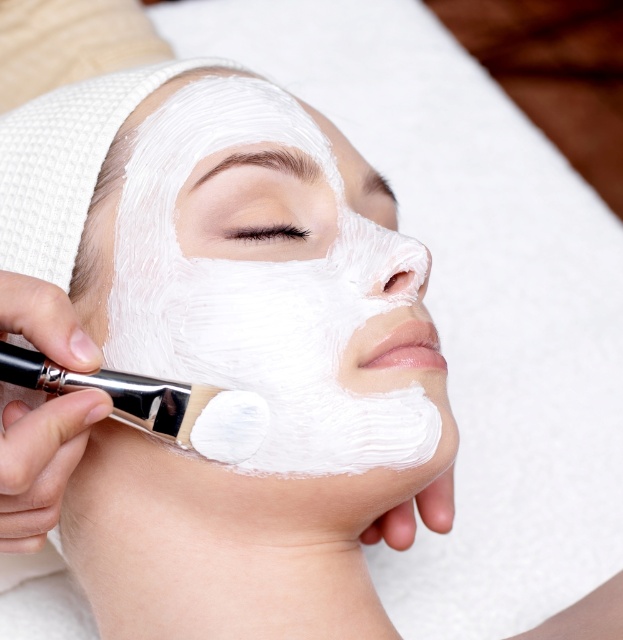
Is white matte brush at center below white matte eye at upper center?

Yes, white matte brush at center is below white matte eye at upper center.

Between point (217, 410) and point (374, 179), which one is positioned in front?

Point (217, 410) is in front.

Image resolution: width=623 pixels, height=640 pixels. What do you see at coordinates (155, 403) in the screenshot?
I see `white matte brush at center` at bounding box center [155, 403].

Find the location of `white matte brush at center`. white matte brush at center is located at coordinates (155, 403).

What do you see at coordinates (265, 232) in the screenshot? The width and height of the screenshot is (623, 640). I see `white matte eyelashes at center` at bounding box center [265, 232].

Locate an element on the screen. The height and width of the screenshot is (640, 623). white matte eyelashes at center is located at coordinates (265, 232).

Does white matte facial mask at center appear on the right side of white matte eye at upper center?

No, white matte facial mask at center is not to the right of white matte eye at upper center.

Is white matte facial mask at center positioned behind white matte eye at upper center?

No, white matte facial mask at center is closer to the viewer.

Locate an element on the screen. white matte facial mask at center is located at coordinates (262, 282).